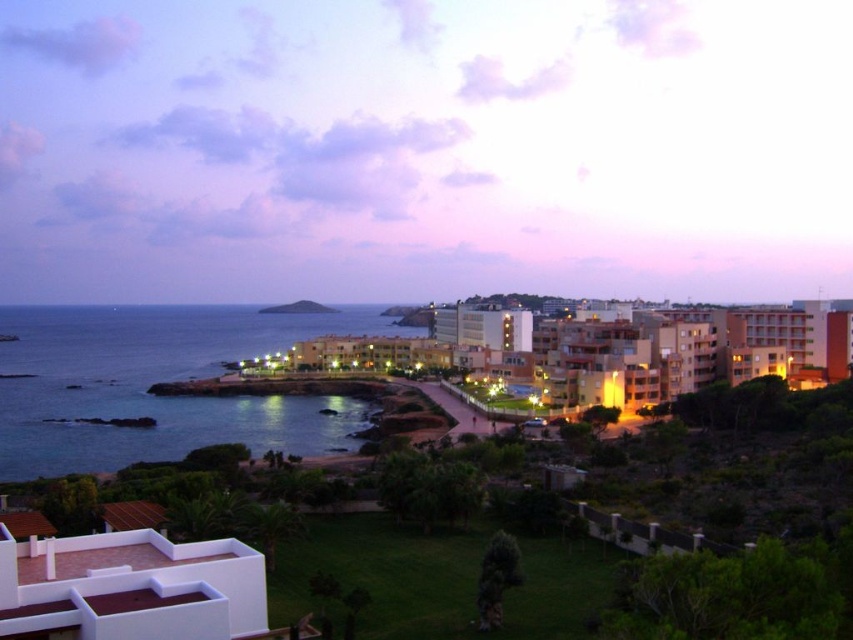
Consider the image. Does blue water at lower left appear over orange brick hotel at center?

Incorrect, blue water at lower left is not positioned above orange brick hotel at center.

Does blue water at lower left have a greater height compared to orange brick hotel at center?

Indeed, blue water at lower left has a greater height compared to orange brick hotel at center.

What do you see at coordinates (157, 381) in the screenshot? I see `blue water at lower left` at bounding box center [157, 381].

The width and height of the screenshot is (853, 640). Identify the location of blue water at lower left. [157, 381].

Does blue water at lower left have a lesser width compared to white matte roof at lower left?

Incorrect, blue water at lower left's width is not less than white matte roof at lower left's.

Consider the image. Is blue water at lower left smaller than white matte roof at lower left?

Actually, blue water at lower left might be larger than white matte roof at lower left.

Measure the distance between point (331, 440) and camera.

A distance of 133.23 meters exists between point (331, 440) and camera.

This screenshot has height=640, width=853. I want to click on blue water at lower left, so click(x=157, y=381).

Based on the photo, who is lower down, orange brick hotel at center or green grassy hillside at center?

orange brick hotel at center is below.

Who is more forward, (469, 376) or (316, 307)?

Point (469, 376) is more forward.

The height and width of the screenshot is (640, 853). In order to click on orange brick hotel at center in this screenshot , I will do `click(608, 355)`.